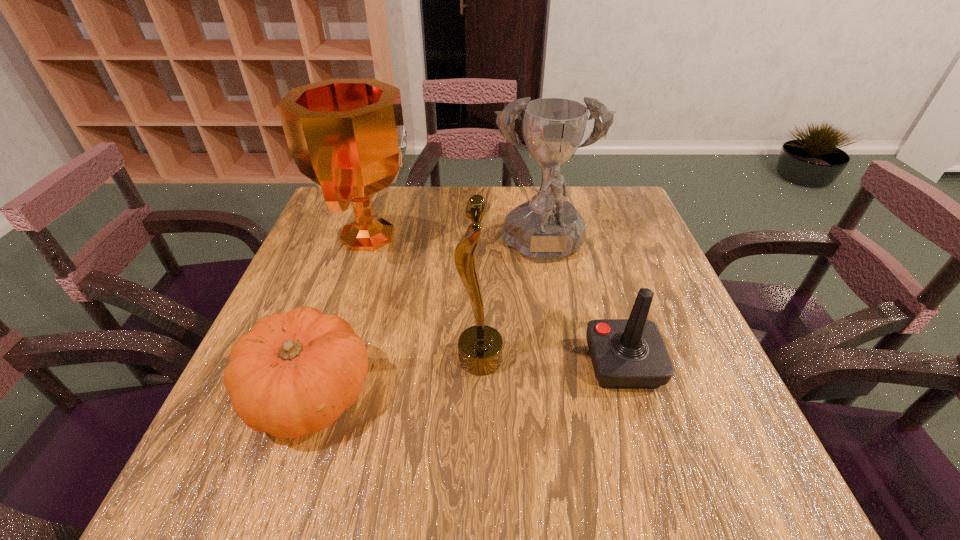
Find the location of `the leftmost award`. the leftmost award is located at coordinates (347, 136).

Identify the location of the nearest award. (480, 347).

Where is `the fourth tallest object`? This screenshot has width=960, height=540. the fourth tallest object is located at coordinates (630, 353).

Find the location of a particular element. The height and width of the screenshot is (540, 960). the shortest object is located at coordinates (294, 373).

Where is `blank area located on the side of the leftmost award with the star emblem`? This screenshot has height=540, width=960. blank area located on the side of the leftmost award with the star emblem is located at coordinates (446, 236).

The image size is (960, 540). In order to click on blank space located 0.210m on the front-facing side of the nearest award in this screenshot , I will do `click(352, 360)`.

Image resolution: width=960 pixels, height=540 pixels. Find the location of `blank area located on the front-facing side of the nearest award`. blank area located on the front-facing side of the nearest award is located at coordinates (337, 360).

Locate an element on the screen. The image size is (960, 540). blank space located on the front-facing side of the nearest award is located at coordinates (372, 360).

This screenshot has height=540, width=960. Find the location of `vacant space situated on the front of the joystick`. vacant space situated on the front of the joystick is located at coordinates 651,457.

Image resolution: width=960 pixels, height=540 pixels. I want to click on free spot located 0.370m on the right of the shortest object, so click(574, 395).